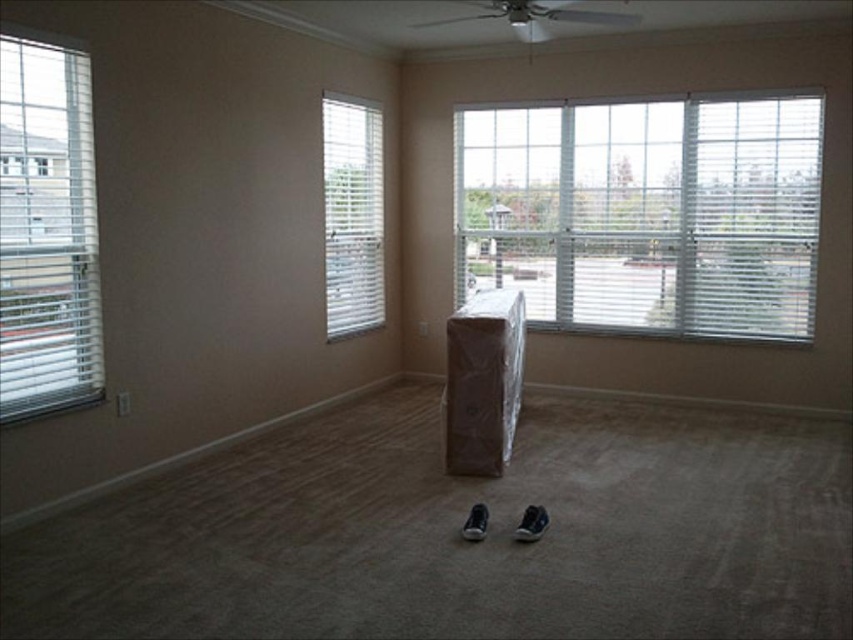
You are a delivery person who needs to place a package in the room. The package is 3 meters long. You see the white textured blinds at upper right and the black suede shoe at center. Can you fit the package horizontally between them without bending it?

The distance between the white textured blinds at upper right and the black suede shoe at center is 3.15 meters, which is slightly longer than the package length of 3 meters. Therefore, the package can fit horizontally between them without bending.